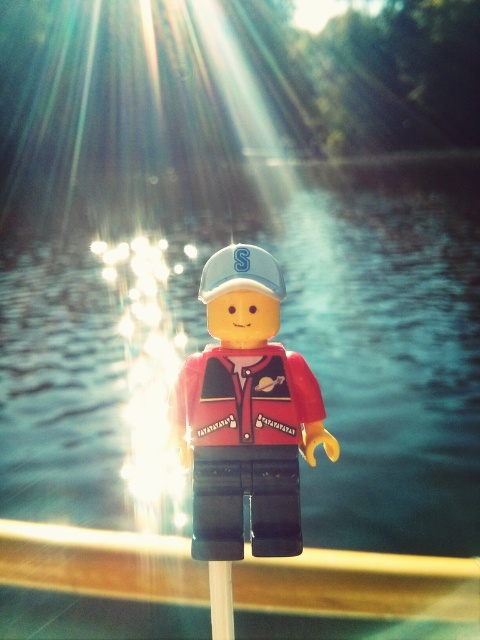
Question: Among these points, which one is nearest to the camera?

Choices:
 (A) (232, 618)
 (B) (274, 538)

Answer: (A)

Question: Based on their relative distances, which object is nearer to the matte red plastic minifigure at center?

Choices:
 (A) blue water at center
 (B) white plastic pole at center

Answer: (B)

Question: In this image, where is blue water at center located relative to matte red plastic minifigure at center?

Choices:
 (A) left
 (B) right

Answer: (B)

Question: Does matte red plastic minifigure at center lie in front of white plastic pole at center?

Choices:
 (A) yes
 (B) no

Answer: (B)

Question: Estimate the real-world distances between objects in this image. Which object is farther from the matte red plastic minifigure at center?

Choices:
 (A) white plastic pole at center
 (B) blue water at center

Answer: (B)

Question: Is blue water at center smaller than matte red plastic minifigure at center?

Choices:
 (A) no
 (B) yes

Answer: (A)